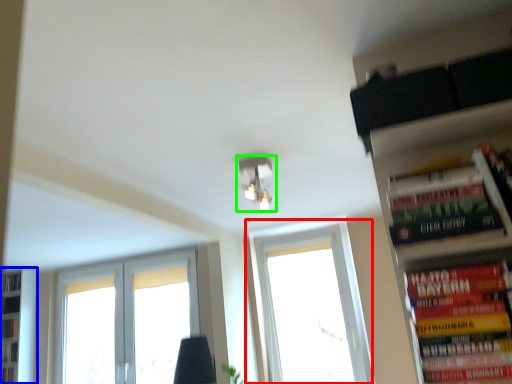
Question: Considering the real-world distances, which object is closest to window (highlighted by a red box)? bookshelf (highlighted by a blue box) or light fixture (highlighted by a green box).

Choices:
 (A) bookshelf
 (B) light fixture

Answer: (B)